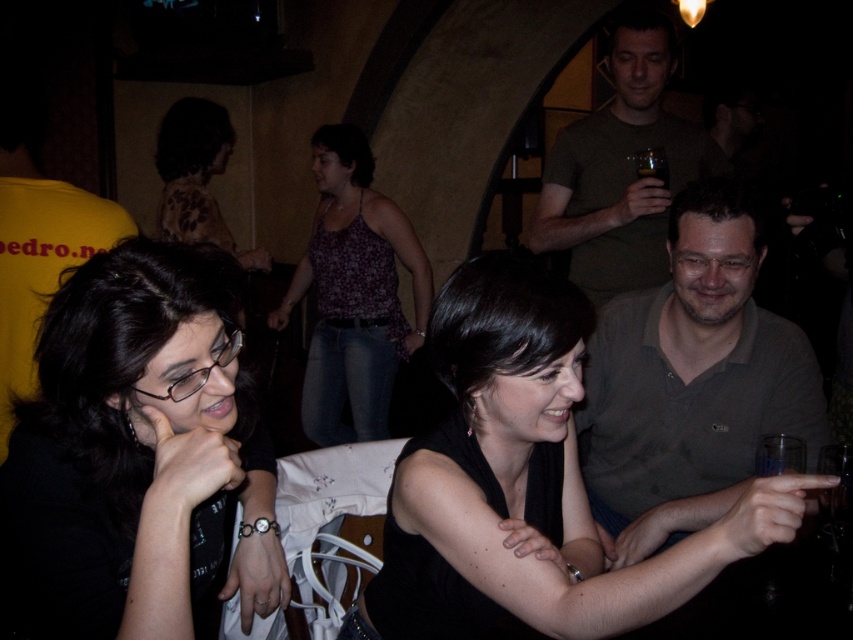
Question: Which point appears closest to the camera in this image?

Choices:
 (A) (599, 296)
 (B) (387, 554)
 (C) (28, 566)

Answer: (C)

Question: Observing the image, what is the correct spatial positioning of black matte dress at center in reference to gray cotton shirt at center?

Choices:
 (A) above
 (B) below

Answer: (B)

Question: Based on their relative distances, which object is nearer to the matte green t-shirt at upper center?

Choices:
 (A) black matte dress at center
 (B) black matte hair at center

Answer: (A)

Question: Among these objects, which one is farthest from the camera?

Choices:
 (A) floral-patterned blouse at upper left
 (B) black matte dress at center
 (C) gray cotton shirt at center
 (D) black matte hair at center

Answer: (A)

Question: Is black matte dress at center to the left of floral-patterned blouse at upper left from the viewer's perspective?

Choices:
 (A) yes
 (B) no

Answer: (B)

Question: Is black matte hair at center above matte green t-shirt at upper center?

Choices:
 (A) no
 (B) yes

Answer: (A)